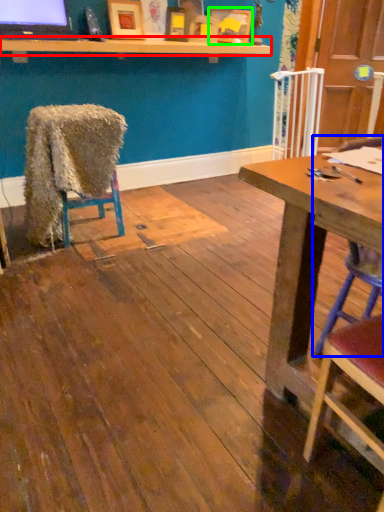
Question: Which object is positioned closest to shelf (highlighted by a red box)? Select from chair (highlighted by a blue box) and picture frame (highlighted by a green box).

Choices:
 (A) chair
 (B) picture frame

Answer: (B)